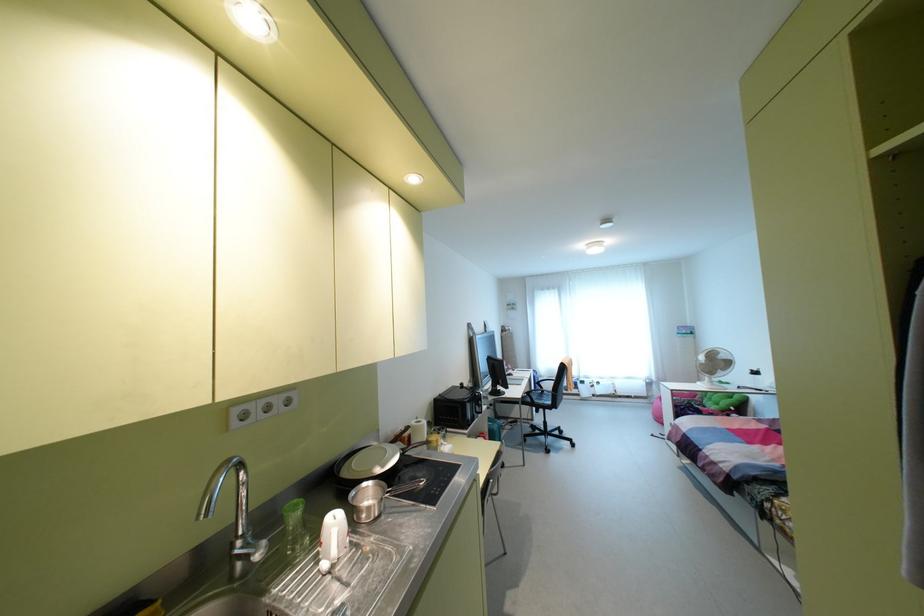
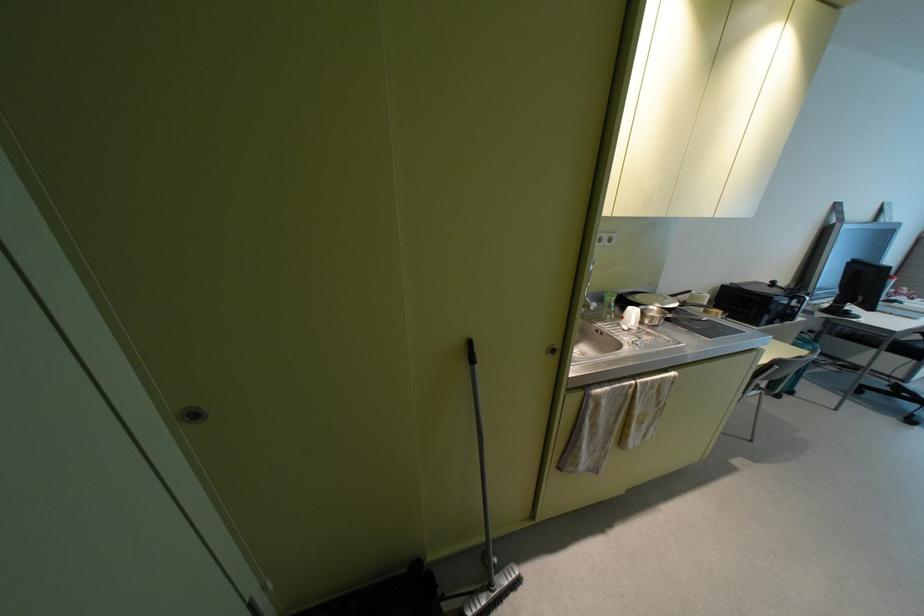
The first image is from the beginning of the video and the second image is from the end. How did the camera likely rotate when shooting the video?

The camera's rotation is toward left-down.